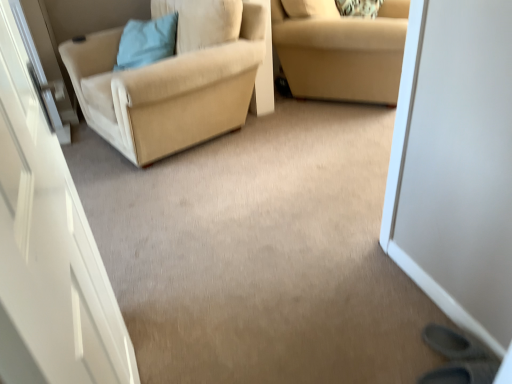
Describe the element at coordinates (178, 79) in the screenshot. The width and height of the screenshot is (512, 384). I see `beige fabric chair at left` at that location.

In order to face beige fabric couch at upper right, should I rotate leftwards or rightwards?

It's best to rotate right around 13.034 degrees.

The width and height of the screenshot is (512, 384). What do you see at coordinates (343, 54) in the screenshot? I see `beige fabric couch at upper right` at bounding box center [343, 54].

Identify the location of light blue fabric pillow at upper left. (147, 42).

Considering the relative sizes of beige fabric couch at upper right and beige fabric chair at left in the image provided, is beige fabric couch at upper right thinner than beige fabric chair at left?

Indeed, beige fabric couch at upper right has a lesser width compared to beige fabric chair at left.

Considering the sizes of objects beige fabric couch at upper right and beige fabric chair at left in the image provided, who is bigger, beige fabric couch at upper right or beige fabric chair at left?

Bigger between the two is beige fabric chair at left.

Considering the relative sizes of beige fabric couch at upper right and beige fabric chair at left in the image provided, is beige fabric couch at upper right taller than beige fabric chair at left?

In fact, beige fabric couch at upper right may be shorter than beige fabric chair at left.

The width and height of the screenshot is (512, 384). I want to click on studio couch on the right of beige fabric chair at left, so click(343, 54).

Can you tell me how much beige fabric chair at left and beige fabric couch at upper right differ in facing direction?

There is a 120-degree angle between the facing directions of beige fabric chair at left and beige fabric couch at upper right.

Is beige fabric chair at left far away from beige fabric couch at upper right?

No.

Does beige fabric chair at left come behind beige fabric couch at upper right?

No, the depth of beige fabric chair at left is less than that of beige fabric couch at upper right.

How far apart are beige fabric chair at left and beige fabric couch at upper right?

A distance of 26.30 inches exists between beige fabric chair at left and beige fabric couch at upper right.

From the picture: Which object is further away from the camera taking this photo, light blue fabric pillow at upper left or beige fabric chair at left?

Positioned behind is light blue fabric pillow at upper left.

How different are the orientations of light blue fabric pillow at upper left and beige fabric chair at left in degrees?

The facing directions of light blue fabric pillow at upper left and beige fabric chair at left are 34.6 degrees apart.

Between light blue fabric pillow at upper left and beige fabric chair at left, which one has larger size?

beige fabric chair at left.

Which object is thinner, light blue fabric pillow at upper left or beige fabric couch at upper right?

Thinner between the two is light blue fabric pillow at upper left.

Which point is more distant from viewer, (124, 37) or (302, 22)?

The point (124, 37) is farther from the camera.

Based on the photo, considering the relative positions of light blue fabric pillow at upper left and beige fabric couch at upper right in the image provided, is light blue fabric pillow at upper left to the left of beige fabric couch at upper right from the viewer's perspective?

Yes.

From the image's perspective, does beige fabric chair at left appear lower than light blue fabric pillow at upper left?

Yes, from the image's perspective, beige fabric chair at left is beneath light blue fabric pillow at upper left.

How different are the orientations of beige fabric chair at left and light blue fabric pillow at upper left in degrees?

The angle between the facing direction of beige fabric chair at left and the facing direction of light blue fabric pillow at upper left is 34.6 degrees.

Is light blue fabric pillow at upper left inside beige fabric chair at left?

Yes, beige fabric chair at left is surrounding light blue fabric pillow at upper left.

The height and width of the screenshot is (384, 512). What are the coordinates of `chair that is under the light blue fabric pillow at upper left (from a real-world perspective)` in the screenshot? It's located at (178, 79).

Is beige fabric couch at upper right looking in the opposite direction of light blue fabric pillow at upper left?

No, beige fabric couch at upper right's orientation is not away from light blue fabric pillow at upper left.

Can you tell me how much beige fabric couch at upper right and light blue fabric pillow at upper left differ in facing direction?

The facing directions of beige fabric couch at upper right and light blue fabric pillow at upper left are 85 degrees apart.

Is beige fabric couch at upper right to the right of light blue fabric pillow at upper left from the viewer's perspective?

Indeed, beige fabric couch at upper right is positioned on the right side of light blue fabric pillow at upper left.

Locate an element on the screen. This screenshot has height=384, width=512. studio couch that appears on the right of beige fabric chair at left is located at coordinates (343, 54).

In order to click on chair that is above the beige fabric couch at upper right (from a real-world perspective) in this screenshot , I will do `click(178, 79)`.

Which object lies further to the anchor point beige fabric chair at left, beige fabric couch at upper right or light blue fabric pillow at upper left?

The object further to beige fabric chair at left is beige fabric couch at upper right.

When comparing their distances from beige fabric couch at upper right, does beige fabric chair at left or light blue fabric pillow at upper left seem further?

light blue fabric pillow at upper left is further to beige fabric couch at upper right.

When comparing their distances from beige fabric chair at left, does light blue fabric pillow at upper left or beige fabric couch at upper right seem further?

beige fabric couch at upper right.

Looking at the image, which one is located further to light blue fabric pillow at upper left, beige fabric couch at upper right or beige fabric chair at left?

beige fabric couch at upper right is further to light blue fabric pillow at upper left.

When comparing their distances from light blue fabric pillow at upper left, does beige fabric chair at left or beige fabric couch at upper right seem closer?

beige fabric chair at left.

Considering their positions, is light blue fabric pillow at upper left positioned further to beige fabric couch at upper right than beige fabric chair at left?

light blue fabric pillow at upper left is further to beige fabric couch at upper right.

Find the location of a particular element. chair between light blue fabric pillow at upper left and beige fabric couch at upper right from left to right is located at coordinates (178, 79).